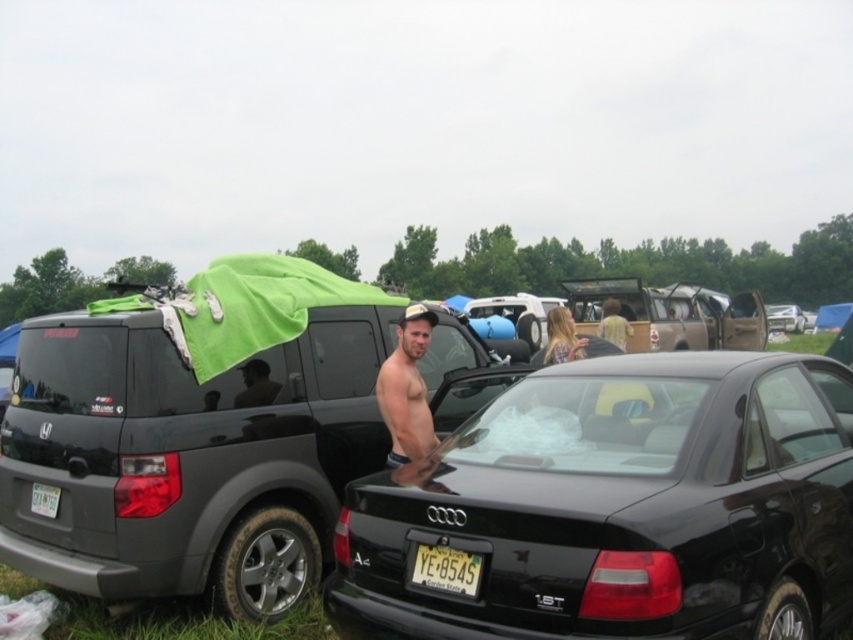
Question: Which of the following is the farthest from the observer?

Choices:
 (A) (32, 509)
 (B) (798, 332)
 (C) (450, 554)

Answer: (B)

Question: Among these objects, which one is nearest to the camera?

Choices:
 (A) skinny man at center
 (B) black glossy sedan at center

Answer: (B)

Question: Which point is farther to the camera?

Choices:
 (A) (113, 337)
 (B) (614, 508)
 (C) (611, 317)
 (D) (790, 307)

Answer: (D)

Question: Is shiny black car door at center bigger than light brown hair at center?

Choices:
 (A) no
 (B) yes

Answer: (A)

Question: Can you confirm if black glossy sedan at center is wider than yellow matte license plate at center?

Choices:
 (A) no
 (B) yes

Answer: (B)

Question: Can you confirm if matte black suv at center is positioned to the right of yellow matte license plate at lower left?

Choices:
 (A) yes
 (B) no

Answer: (A)